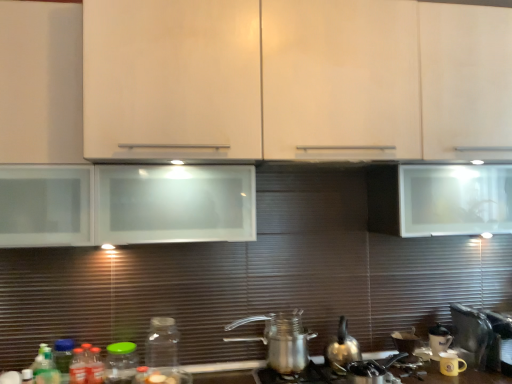
This screenshot has height=384, width=512. Find the location of `green matte bottle at lower left, which appears as the 4th bottle when viewed from the right`. green matte bottle at lower left, which appears as the 4th bottle when viewed from the right is located at coordinates 46,369.

Find the location of a particular element. The width and height of the screenshot is (512, 384). green glass jar at lower left, which appears as the 2th bottle when viewed from the right is located at coordinates (121, 363).

How much space does green glass jar at lower left, which appears as the 2th bottle when viewed from the right, occupy horizontally?

6.81 inches.

Describe the element at coordinates (333, 372) in the screenshot. I see `silver metallic gas stove at lower center` at that location.

The height and width of the screenshot is (384, 512). What are the coordinates of `metallic silver coffee pot at center` in the screenshot? It's located at (281, 341).

The height and width of the screenshot is (384, 512). Identify the location of metallic silver toaster at lower right, which is the 3th appliance from left to right. (482, 336).

What is the approximate width of yellow matte mug at lower right, arranged as the 1th appliance when viewed from the left?

yellow matte mug at lower right, arranged as the 1th appliance when viewed from the left, is 3.39 inches in width.

Find the location of a particular element. This screenshot has width=512, height=384. white glossy coffee cup at lower right, which is the second appliance from left to right is located at coordinates (439, 340).

How different are the orientations of translucent plastic bottle at lower left, positioned as the 3th bottle in right-to-left order, and green glass jar at lower left, which appears as the 2th bottle when viewed from the right, in degrees?

The angular difference between translucent plastic bottle at lower left, positioned as the 3th bottle in right-to-left order, and green glass jar at lower left, which appears as the 2th bottle when viewed from the right, is 1.39 degrees.

Is translucent plastic bottle at lower left, positioned as the 3th bottle in right-to-left order, facing towards green glass jar at lower left, which appears as the 2th bottle when viewed from the right?

No.

Considering the sizes of translucent plastic bottle at lower left, the 3th bottle positioned from the left, and green glass jar at lower left, the 4th bottle when ordered from left to right, in the image, is translucent plastic bottle at lower left, the 3th bottle positioned from the left, taller or shorter than green glass jar at lower left, the 4th bottle when ordered from left to right,?

translucent plastic bottle at lower left, the 3th bottle positioned from the left, is shorter than green glass jar at lower left, the 4th bottle when ordered from left to right.

Does point (101, 366) come behind point (129, 371)?

No, (101, 366) is closer to viewer.

Is the position of silver metallic gas stove at lower center less distant than that of translucent plastic bottle at lower left, positioned as the 3th bottle in right-to-left order?

Yes, silver metallic gas stove at lower center is in front of translucent plastic bottle at lower left, positioned as the 3th bottle in right-to-left order.

Considering the sizes of silver metallic gas stove at lower center and translucent plastic bottle at lower left, positioned as the 3th bottle in right-to-left order, in the image, is silver metallic gas stove at lower center bigger or smaller than translucent plastic bottle at lower left, positioned as the 3th bottle in right-to-left order,?

Considering their sizes, silver metallic gas stove at lower center takes up more space than translucent plastic bottle at lower left, positioned as the 3th bottle in right-to-left order.

Consider the image. Considering the positions of objects silver metallic gas stove at lower center and translucent plastic bottle at lower left, positioned as the 3th bottle in right-to-left order, in the image provided, who is more to the left, silver metallic gas stove at lower center or translucent plastic bottle at lower left, positioned as the 3th bottle in right-to-left order,?

Positioned to the left is translucent plastic bottle at lower left, positioned as the 3th bottle in right-to-left order.

Image resolution: width=512 pixels, height=384 pixels. In order to click on bottle that is the 3rd one when counting upward from the silver metallic gas stove at lower center (from the image's perspective) in this screenshot , I will do `click(94, 367)`.

What are the coordinates of `the 3rd bottle in front when counting from the translucent plastic bottle at lower left, the 3th bottle positioned from the left` in the screenshot? It's located at (46, 369).

Is translucent plastic bottle at lower left, positioned as the 3th bottle in right-to-left order, oriented away from green matte bottle at lower left, positioned as the 2th bottle in left-to-right order?

No, translucent plastic bottle at lower left, positioned as the 3th bottle in right-to-left order, is not facing away from green matte bottle at lower left, positioned as the 2th bottle in left-to-right order.

Can you see translucent plastic bottle at lower left, the 3th bottle positioned from the left, touching green matte bottle at lower left, which appears as the 4th bottle when viewed from the right?

No, translucent plastic bottle at lower left, the 3th bottle positioned from the left, is not with green matte bottle at lower left, which appears as the 4th bottle when viewed from the right.

Which point is more distant from viewer, (x=455, y=335) or (x=438, y=334)?

Positioned behind is point (x=438, y=334).

Is metallic silver toaster at lower right, which is the 3th appliance from left to right, aimed at white glossy coffee cup at lower right, acting as the 2th appliance starting from the right?

No, metallic silver toaster at lower right, which is the 3th appliance from left to right, is not aimed at white glossy coffee cup at lower right, acting as the 2th appliance starting from the right.

Find the location of `appliance that is the 2nd object located behind the metallic silver toaster at lower right, marked as the 1th appliance in a right-to-left arrangement`. appliance that is the 2nd object located behind the metallic silver toaster at lower right, marked as the 1th appliance in a right-to-left arrangement is located at coordinates (439, 340).

Which is behind, metallic silver toaster at lower right, marked as the 1th appliance in a right-to-left arrangement, or white glossy coffee cup at lower right, acting as the 2th appliance starting from the right?

white glossy coffee cup at lower right, acting as the 2th appliance starting from the right, is further from the camera.

Considering the sizes of translucent plastic bottle at lower left, positioned as the 3th bottle in right-to-left order, and white glossy coffee cup at lower right, acting as the 2th appliance starting from the right, in the image, is translucent plastic bottle at lower left, positioned as the 3th bottle in right-to-left order, taller or shorter than white glossy coffee cup at lower right, acting as the 2th appliance starting from the right,?

Clearly, translucent plastic bottle at lower left, positioned as the 3th bottle in right-to-left order, is taller compared to white glossy coffee cup at lower right, acting as the 2th appliance starting from the right.

Who is bigger, translucent plastic bottle at lower left, positioned as the 3th bottle in right-to-left order, or white glossy coffee cup at lower right, which is the second appliance from left to right?

Bigger between the two is translucent plastic bottle at lower left, positioned as the 3th bottle in right-to-left order.

Which bottle is the 3rd one when counting from the left side of the white glossy coffee cup at lower right, which is the second appliance from left to right? Please provide its 2D coordinates.

[(94, 367)]

In the image, is green matte bottle at lower left, positioned as the 2th bottle in left-to-right order, positioned in front of or behind transparent glass jar at lower center, acting as the fifth bottle starting from the left?

green matte bottle at lower left, positioned as the 2th bottle in left-to-right order, is positioned closer to the viewer than transparent glass jar at lower center, acting as the fifth bottle starting from the left.

Which is closer to the camera, (38,371) or (159,323)?

Positioned in front is point (38,371).

I want to click on bottle that is the 4th one when counting upward from the green matte bottle at lower left, which appears as the 4th bottle when viewed from the right (from the image's perspective), so click(162, 343).

Based on their sizes in the image, would you say yellow matte mug at lower right, arranged as the 1th appliance when viewed from the left, is bigger or smaller than metallic silver kettle at lower center?

Considering their sizes, yellow matte mug at lower right, arranged as the 1th appliance when viewed from the left, takes up less space than metallic silver kettle at lower center.

Considering the sizes of yellow matte mug at lower right, the 3th appliance positioned from the right, and metallic silver kettle at lower center in the image, is yellow matte mug at lower right, the 3th appliance positioned from the right, taller or shorter than metallic silver kettle at lower center?

Clearly, yellow matte mug at lower right, the 3th appliance positioned from the right, is shorter compared to metallic silver kettle at lower center.

Is yellow matte mug at lower right, arranged as the 1th appliance when viewed from the left, to the right of metallic silver kettle at lower center from the viewer's perspective?

Indeed, yellow matte mug at lower right, arranged as the 1th appliance when viewed from the left, is positioned on the right side of metallic silver kettle at lower center.

From the translucent plastic bottle at lower left, positioned as the 3th bottle in right-to-left order, count 1st bottle to the right and point to it. Please provide its 2D coordinates.

[(121, 363)]

Where is `the 3rd bottle above the silver metallic gas stove at lower center (from a real-world perspective)`? the 3rd bottle above the silver metallic gas stove at lower center (from a real-world perspective) is located at coordinates (94, 367).

When comparing their distances from metallic silver toaster at lower right, which is the 3th appliance from left to right, does green matte bottle at lower left, positioned as the 2th bottle in left-to-right order, or white glossy coffee cup at lower right, which is the second appliance from left to right, seem further?

The object further to metallic silver toaster at lower right, which is the 3th appliance from left to right, is green matte bottle at lower left, positioned as the 2th bottle in left-to-right order.

Based on the photo, looking at the image, which one is located closer to transparent glass jar at lower center, acting as the fifth bottle starting from the left, green glass jar at lower left, which appears as the 2th bottle when viewed from the right, or yellow matte mug at lower right, arranged as the 1th appliance when viewed from the left?

green glass jar at lower left, which appears as the 2th bottle when viewed from the right, lies closer to transparent glass jar at lower center, acting as the fifth bottle starting from the left, than the other object.

Based on the photo, looking at the image, which one is located further to green matte bottle at lower left, positioned as the 2th bottle in left-to-right order, metallic silver toaster at lower right, which is the 3th appliance from left to right, or white glossy coffee cup at lower right, which is the second appliance from left to right?

metallic silver toaster at lower right, which is the 3th appliance from left to right.

Considering their positions, is transparent glass jar at lower center, acting as the fifth bottle starting from the left, positioned closer to silver metallic gas stove at lower center than white glossy coffee cup at lower right, acting as the 2th appliance starting from the right?

Based on the image, white glossy coffee cup at lower right, acting as the 2th appliance starting from the right, appears to be nearer to silver metallic gas stove at lower center.

Looking at the image, which one is located further to metallic silver kettle at lower center, metallic silver coffee pot at center or matte white cabinet at center?

The object further to metallic silver kettle at lower center is matte white cabinet at center.

When comparing their distances from translucent plastic bottle at lower left, positioned as the 3th bottle in right-to-left order, does green matte bottle at lower left, which appears as the 4th bottle when viewed from the right, or green glass jar at lower left, the 4th bottle when ordered from left to right, seem closer?

Among the two, green glass jar at lower left, the 4th bottle when ordered from left to right, is located nearer to translucent plastic bottle at lower left, positioned as the 3th bottle in right-to-left order.

Looking at the image, which one is located further to yellow matte mug at lower right, the 3th appliance positioned from the right, green matte jar at lower left, marked as the first bottle in a left-to-right arrangement, or metallic silver kettle at lower center?

The object further to yellow matte mug at lower right, the 3th appliance positioned from the right, is green matte jar at lower left, marked as the first bottle in a left-to-right arrangement.

In the scene shown: Based on their spatial positions, is green matte jar at lower left, acting as the fifth bottle starting from the right, or matte white cabinet at center closer to metallic silver toaster at lower right, marked as the 1th appliance in a right-to-left arrangement?

The object closer to metallic silver toaster at lower right, marked as the 1th appliance in a right-to-left arrangement, is matte white cabinet at center.

Locate an element on the screen. This screenshot has height=384, width=512. home appliance between matte white cabinet at center and metallic silver toaster at lower right, which is the 3th appliance from left to right, from top to bottom is located at coordinates (342, 349).

Identify the location of gas stove between green matte jar at lower left, marked as the first bottle in a left-to-right arrangement, and metallic silver toaster at lower right, marked as the 1th appliance in a right-to-left arrangement, in the horizontal direction. This screenshot has width=512, height=384. (333, 372).

The width and height of the screenshot is (512, 384). I want to click on kitchen appliance situated between transparent glass jar at lower center, the 1th bottle viewed from the right, and silver metallic gas stove at lower center from left to right, so click(281, 341).

The image size is (512, 384). What are the coordinates of `gas stove situated between transparent glass jar at lower center, acting as the fifth bottle starting from the left, and metallic silver toaster at lower right, which is the 3th appliance from left to right, from left to right` in the screenshot? It's located at (333, 372).